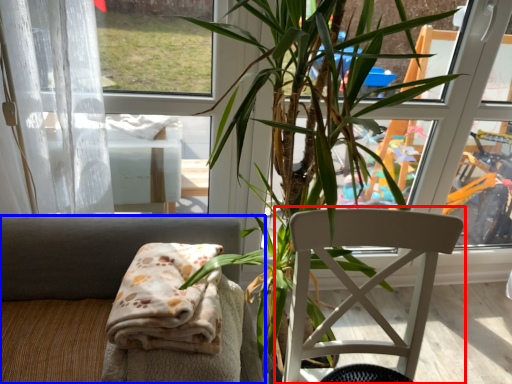
Question: Which object appears farthest to the camera in this image, chair (highlighted by a red box) or chair (highlighted by a blue box)?

Choices:
 (A) chair
 (B) chair

Answer: (B)